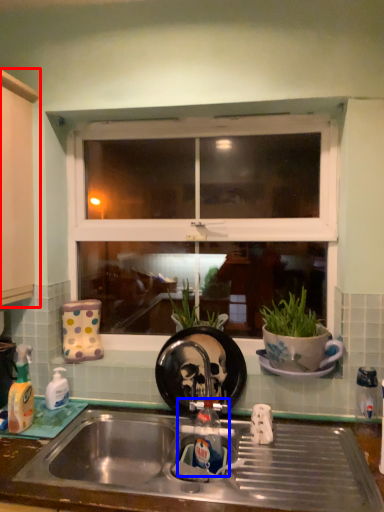
Question: Among these objects, which one is farthest to the camera, cabinetry (highlighted by a red box) or tap (highlighted by a blue box)?

Choices:
 (A) cabinetry
 (B) tap

Answer: (A)